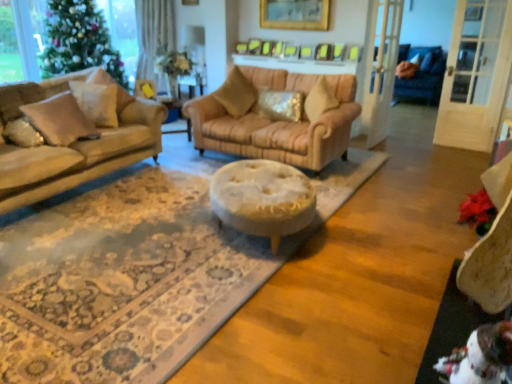
What is the approximate height of matte gold pillow at left, the 5th pillow in the right-to-left sequence?

The height of matte gold pillow at left, the 5th pillow in the right-to-left sequence, is 7.93 inches.

The width and height of the screenshot is (512, 384). In order to click on beige fabric pillow at left, which is the 3th pillow in left-to-right order in this screenshot , I will do `click(111, 84)`.

Identify the location of green matte christmas tree at left. (79, 41).

In order to face velvet beige swivel chair at lower right, should I rotate leftwards or rightwards?

It's best to rotate right around 29.559 degrees.

Describe the element at coordinates (280, 105) in the screenshot. I see `metallic sequined pillow at center, arranged as the 1th pillow when viewed from the right` at that location.

Identify the location of matte gold pillow at left, the 1th pillow in the left-to-right sequence. Image resolution: width=512 pixels, height=384 pixels. (22, 133).

In terms of width, does metallic sequined pillow at center, arranged as the 1th pillow when viewed from the right, look wider or thinner when compared to green matte christmas tree at left?

Clearly, metallic sequined pillow at center, arranged as the 1th pillow when viewed from the right, has less width compared to green matte christmas tree at left.

Considering the positions of point (291, 94) and point (104, 48), is point (291, 94) closer or farther from the camera than point (104, 48)?

Clearly, point (291, 94) is closer to the camera than point (104, 48).

Considering the relative sizes of metallic sequined pillow at center, arranged as the 1th pillow when viewed from the right, and green matte christmas tree at left in the image provided, is metallic sequined pillow at center, arranged as the 1th pillow when viewed from the right, bigger than green matte christmas tree at left?

Incorrect, metallic sequined pillow at center, arranged as the 1th pillow when viewed from the right, is not larger than green matte christmas tree at left.

From the picture: Between metallic sequined pillow at center, arranged as the 1th pillow when viewed from the right, and green matte christmas tree at left, which one has more height?

green matte christmas tree at left.

From the picture: Considering the positions of objects matte gold pillow at left, the 5th pillow in the right-to-left sequence, and beige fabric pillow at left, the third pillow when ordered from right to left, in the image provided, who is behind, matte gold pillow at left, the 5th pillow in the right-to-left sequence, or beige fabric pillow at left, the third pillow when ordered from right to left,?

beige fabric pillow at left, the third pillow when ordered from right to left, is further away from the camera.

Considering the sizes of matte gold pillow at left, the 1th pillow in the left-to-right sequence, and beige fabric pillow at left, the third pillow when ordered from right to left, in the image, is matte gold pillow at left, the 1th pillow in the left-to-right sequence, wider or thinner than beige fabric pillow at left, the third pillow when ordered from right to left,?

Clearly, matte gold pillow at left, the 1th pillow in the left-to-right sequence, has less width compared to beige fabric pillow at left, the third pillow when ordered from right to left.

Between point (12, 130) and point (100, 70), which one is positioned in front?

The point (12, 130) is more forward.

Is matte gold pillow at left, the 1th pillow in the left-to-right sequence, not inside beige fabric pillow at left, which is the 3th pillow in left-to-right order?

That's correct, matte gold pillow at left, the 1th pillow in the left-to-right sequence, is outside of beige fabric pillow at left, which is the 3th pillow in left-to-right order.

Can we say beige fabric pillow at left, the 4th pillow positioned from the right, lies outside green matte christmas tree at left?

Yes.

Considering the positions of objects beige fabric pillow at left, the 2th pillow viewed from the left, and green matte christmas tree at left in the image provided, who is behind, beige fabric pillow at left, the 2th pillow viewed from the left, or green matte christmas tree at left?

green matte christmas tree at left is further from the camera.

From the image's perspective, is beige fabric pillow at left, the 4th pillow positioned from the right, above or below green matte christmas tree at left?

beige fabric pillow at left, the 4th pillow positioned from the right, is situated lower than green matte christmas tree at left in the image.

Is there a large distance between beige fabric pillow at left, which is the 3th pillow in left-to-right order, and beige fabric pillow at center, the 4th pillow in the left-to-right sequence?

That's right, there is a large distance between beige fabric pillow at left, which is the 3th pillow in left-to-right order, and beige fabric pillow at center, the 4th pillow in the left-to-right sequence.

Can you confirm if beige fabric pillow at left, the third pillow when ordered from right to left, is wider than beige fabric pillow at center, the 2th pillow when ordered from right to left?

No, beige fabric pillow at left, the third pillow when ordered from right to left, is not wider than beige fabric pillow at center, the 2th pillow when ordered from right to left.

Which of these two, beige fabric pillow at left, the third pillow when ordered from right to left, or beige fabric pillow at center, the 2th pillow when ordered from right to left, is bigger?

Bigger between the two is beige fabric pillow at center, the 2th pillow when ordered from right to left.

Where is `pillow above the beige fabric pillow at left, which is the 3th pillow in left-to-right order (from the image's perspective)`? The image size is (512, 384). pillow above the beige fabric pillow at left, which is the 3th pillow in left-to-right order (from the image's perspective) is located at coordinates (236, 94).

Is metallic sequined pillow at center, arranged as the 1th pillow when viewed from the right, at the back of velvet beige swivel chair at lower right?

velvet beige swivel chair at lower right does not have its back to metallic sequined pillow at center, arranged as the 1th pillow when viewed from the right.

Is velvet beige swivel chair at lower right in front of or behind metallic sequined pillow at center, arranged as the 1th pillow when viewed from the right, in the image?

Visually, velvet beige swivel chair at lower right is located in front of metallic sequined pillow at center, arranged as the 1th pillow when viewed from the right.

Can you confirm if velvet beige swivel chair at lower right is wider than metallic sequined pillow at center, placed as the 5th pillow when sorted from left to right?

In fact, velvet beige swivel chair at lower right might be narrower than metallic sequined pillow at center, placed as the 5th pillow when sorted from left to right.

Is velvet beige swivel chair at lower right to the left or to the right of metallic sequined pillow at center, arranged as the 1th pillow when viewed from the right, in the image?

velvet beige swivel chair at lower right is to the right of metallic sequined pillow at center, arranged as the 1th pillow when viewed from the right.

In terms of height, does beige fabric pillow at left, the 4th pillow positioned from the right, look taller or shorter compared to matte gold pillow at left, the 5th pillow in the right-to-left sequence?

In the image, beige fabric pillow at left, the 4th pillow positioned from the right, appears to be taller than matte gold pillow at left, the 5th pillow in the right-to-left sequence.

Does beige fabric pillow at left, the 2th pillow viewed from the left, appear on the left side of matte gold pillow at left, the 1th pillow in the left-to-right sequence?

No, beige fabric pillow at left, the 2th pillow viewed from the left, is not to the left of matte gold pillow at left, the 1th pillow in the left-to-right sequence.

Based on the photo, is beige fabric pillow at left, the 4th pillow positioned from the right, aimed at matte gold pillow at left, the 5th pillow in the right-to-left sequence?

Yes, beige fabric pillow at left, the 4th pillow positioned from the right, is oriented towards matte gold pillow at left, the 5th pillow in the right-to-left sequence.

Does point (75, 81) lie in front of point (8, 132)?

No, it is behind (8, 132).

Which object is more forward, beige fabric pillow at left, which is the 3th pillow in left-to-right order, or beige fabric pillow at left, the 4th pillow positioned from the right?

beige fabric pillow at left, which is the 3th pillow in left-to-right order, is in front.

From the image's perspective, is beige fabric pillow at left, the third pillow when ordered from right to left, on beige fabric pillow at left, the 2th pillow viewed from the left?

Yes, from the image's perspective, beige fabric pillow at left, the third pillow when ordered from right to left, is over beige fabric pillow at left, the 2th pillow viewed from the left.

Can you confirm if beige fabric pillow at left, which is the 3th pillow in left-to-right order, is positioned to the left of beige fabric pillow at left, the 4th pillow positioned from the right?

No, beige fabric pillow at left, which is the 3th pillow in left-to-right order, is not to the left of beige fabric pillow at left, the 4th pillow positioned from the right.

Where is `the 2nd pillow in front of the green matte christmas tree at left, counting from the anchor's position`? The width and height of the screenshot is (512, 384). the 2nd pillow in front of the green matte christmas tree at left, counting from the anchor's position is located at coordinates pos(280,105).

Which pillow is the 1st one when counting from the back of the matte gold pillow at left, the 5th pillow in the right-to-left sequence? Please provide its 2D coordinates.

[(111, 84)]

Looking at the image, which one is located closer to green matte christmas tree at left, matte gold pillow at left, the 5th pillow in the right-to-left sequence, or beige fabric pillow at left, the 4th pillow positioned from the right?

beige fabric pillow at left, the 4th pillow positioned from the right, lies closer to green matte christmas tree at left than the other object.

Looking at the image, which one is located closer to matte gold pillow at left, the 5th pillow in the right-to-left sequence, beige fabric pillow at left, the 2th pillow viewed from the left, or metallic sequined pillow at center, placed as the 5th pillow when sorted from left to right?

beige fabric pillow at left, the 2th pillow viewed from the left, lies closer to matte gold pillow at left, the 5th pillow in the right-to-left sequence, than the other object.

Based on their spatial positions, is velvet beige swivel chair at lower right or beige fabric pillow at center, the 4th pillow in the left-to-right sequence, closer to green matte christmas tree at left?

The object closer to green matte christmas tree at left is beige fabric pillow at center, the 4th pillow in the left-to-right sequence.

Based on their spatial positions, is velvet beige swivel chair at lower right or beige fabric pillow at center, the 4th pillow in the left-to-right sequence, closer to matte gold pillow at left, the 1th pillow in the left-to-right sequence?

beige fabric pillow at center, the 4th pillow in the left-to-right sequence.

Looking at the image, which one is located closer to beige fabric pillow at left, the third pillow when ordered from right to left, metallic sequined pillow at center, arranged as the 1th pillow when viewed from the right, or green matte christmas tree at left?

Among the two, metallic sequined pillow at center, arranged as the 1th pillow when viewed from the right, is located nearer to beige fabric pillow at left, the third pillow when ordered from right to left.

Estimate the real-world distances between objects in this image. Which object is further from green matte christmas tree at left, beige fabric pillow at left, the 2th pillow viewed from the left, or beige fabric pillow at center, the 4th pillow in the left-to-right sequence?

Among the two, beige fabric pillow at center, the 4th pillow in the left-to-right sequence, is located further to green matte christmas tree at left.

Based on their spatial positions, is beige fabric pillow at center, the 2th pillow when ordered from right to left, or matte gold pillow at left, the 5th pillow in the right-to-left sequence, closer to velvet beige swivel chair at lower right?

matte gold pillow at left, the 5th pillow in the right-to-left sequence, is closer to velvet beige swivel chair at lower right.

Based on their spatial positions, is beige fabric pillow at left, the 4th pillow positioned from the right, or metallic sequined pillow at center, arranged as the 1th pillow when viewed from the right, further from beige fabric pillow at center, the 2th pillow when ordered from right to left?

beige fabric pillow at left, the 4th pillow positioned from the right, is positioned further to the anchor beige fabric pillow at center, the 2th pillow when ordered from right to left.

The image size is (512, 384). What are the coordinates of `pillow situated between beige fabric pillow at left, the 2th pillow viewed from the left, and beige fabric pillow at center, the 2th pillow when ordered from right to left, from left to right` in the screenshot? It's located at (111, 84).

I want to click on pillow located between velvet beige swivel chair at lower right and beige fabric pillow at left, which is the 3th pillow in left-to-right order, in the depth direction, so click(22, 133).

Where is `pillow between beige fabric pillow at left, the third pillow when ordered from right to left, and metallic sequined pillow at center, arranged as the 1th pillow when viewed from the right`? This screenshot has width=512, height=384. pillow between beige fabric pillow at left, the third pillow when ordered from right to left, and metallic sequined pillow at center, arranged as the 1th pillow when viewed from the right is located at coordinates (236, 94).

Find the location of a particular element. Image resolution: width=512 pixels, height=384 pixels. pillow between matte gold pillow at left, the 5th pillow in the right-to-left sequence, and beige fabric pillow at left, the 4th pillow positioned from the right, along the z-axis is located at coordinates (111, 84).